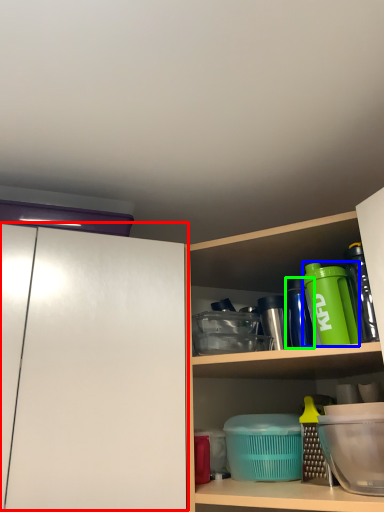
Question: Considering the real-world distances, which object is closest to glass door (highlighted by a red box)? bottle (highlighted by a blue box) or bottle (highlighted by a green box).

Choices:
 (A) bottle
 (B) bottle

Answer: (A)